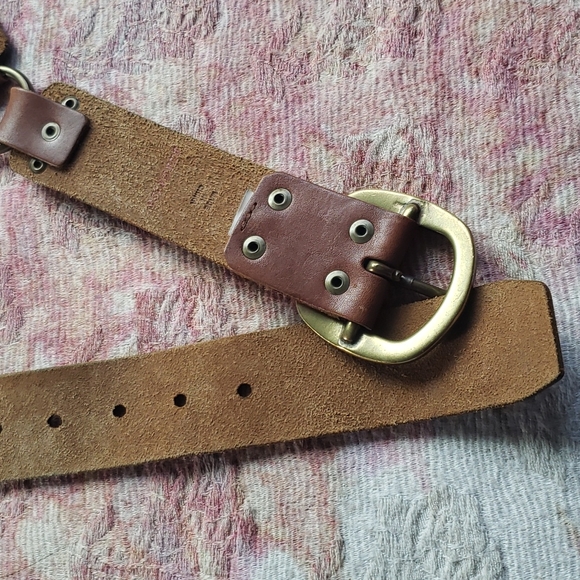
You are a GUI agent. You are given a task and a screenshot of the screen. Output one action in this format:
    pyautogui.click(x=<x>, y=<y>)
    Task: Click on the grommet
    The image size is (580, 580).
    Given the screenshot: What is the action you would take?
    pyautogui.click(x=358, y=365), pyautogui.click(x=300, y=334), pyautogui.click(x=387, y=278), pyautogui.click(x=339, y=253), pyautogui.click(x=452, y=50), pyautogui.click(x=478, y=68), pyautogui.click(x=416, y=32)